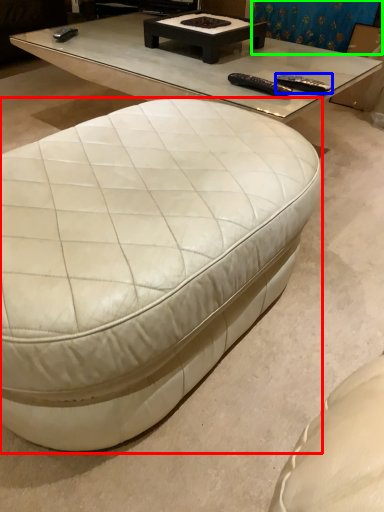
Question: Considering the real-world distances, which object is closest to coffee table (highlighted by a red box)? remote (highlighted by a blue box) or curtain (highlighted by a green box).

Choices:
 (A) remote
 (B) curtain

Answer: (A)